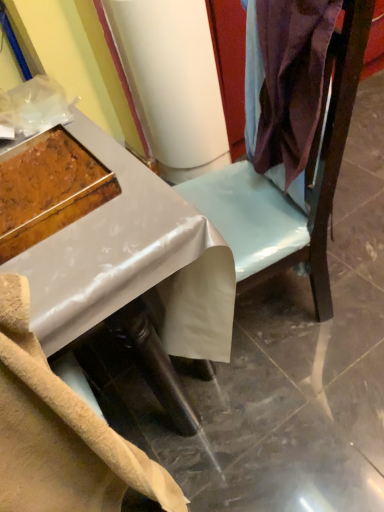
Where is `vacant region to the right of white glossy desk at center`? vacant region to the right of white glossy desk at center is located at coordinates (312, 336).